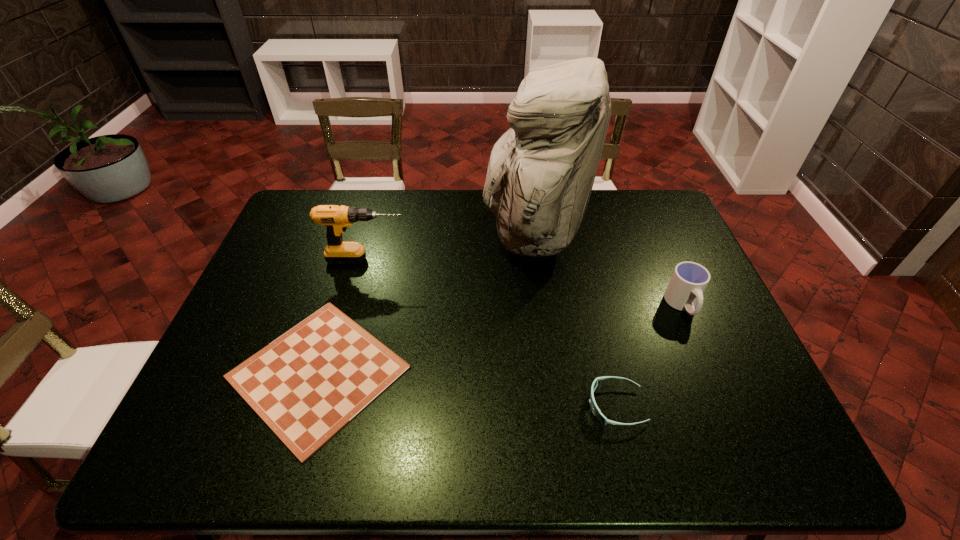
Where is `backpack`? backpack is located at coordinates (541, 171).

Image resolution: width=960 pixels, height=540 pixels. What are the coordinates of `drill` in the screenshot? It's located at (336, 218).

Where is `the rightmost object`? Image resolution: width=960 pixels, height=540 pixels. the rightmost object is located at coordinates (689, 280).

Identify the location of cup. The width and height of the screenshot is (960, 540). (689, 280).

Find the location of `goggles`. goggles is located at coordinates [596, 411].

Identify the location of the shortest object. (308, 384).

Image resolution: width=960 pixels, height=540 pixels. In order to click on free location located on the front-facing side of the tallest object in this screenshot , I will do `click(404, 234)`.

Where is `vacant space located 0.260m on the front-facing side of the tallest object`? This screenshot has height=540, width=960. vacant space located 0.260m on the front-facing side of the tallest object is located at coordinates (404, 234).

I want to click on blank space located on the front-facing side of the tallest object, so [x=431, y=234].

I want to click on free space located 0.330m at the tip of the fourth shortest object, so click(514, 259).